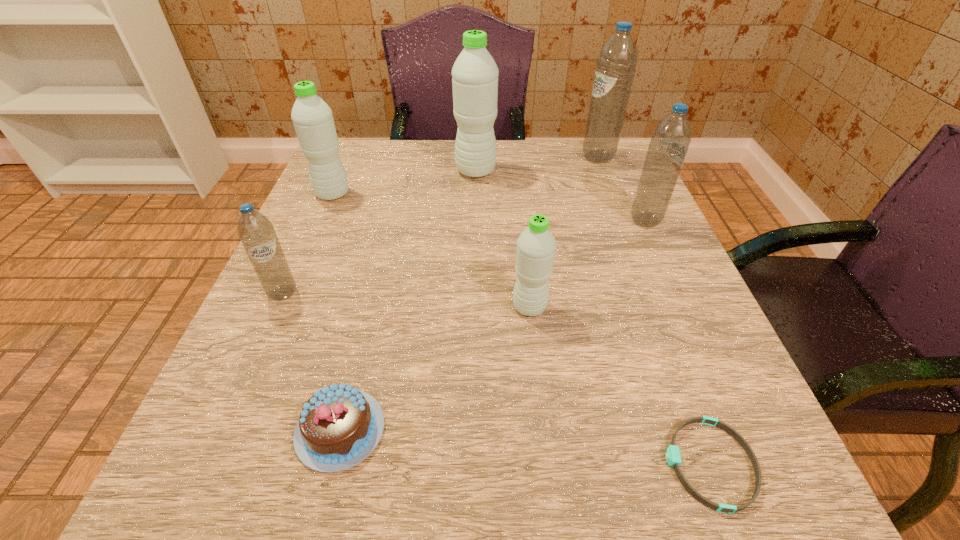
Choose which water bottle is the second nearest neighbor to the second farthest blue water bottle. Please provide its 2D coordinates. Your answer should be formatted as a tuple, i.e. [(x, y)], where the tuple contains the x and y coordinates of a point satisfying the conditions above.

[(536, 245)]

Point out which water bottle is positioned as the third nearest to the farthest green water bottle. Please provide its 2D coordinates. Your answer should be formatted as a tuple, i.e. [(x, y)], where the tuple contains the x and y coordinates of a point satisfying the conditions above.

[(669, 144)]

What are the coordinates of `green water bottle that can be found as the third closest to the shortest object` in the screenshot? It's located at (312, 118).

Identify which green water bottle is the third closest to the nearest blue water bottle. Please provide its 2D coordinates. Your answer should be formatted as a tuple, i.e. [(x, y)], where the tuple contains the x and y coordinates of a point satisfying the conditions above.

[(475, 74)]

Identify the location of blue water bottle that stands as the closest to the second smallest blue water bottle. (616, 63).

Locate which blue water bottle is the third closest to the rightmost green water bottle. Please provide its 2D coordinates. Your answer should be formatted as a tuple, i.e. [(x, y)], where the tuple contains the x and y coordinates of a point satisfying the conditions above.

[(616, 63)]

Find the location of a particular element. vacant region that satisfies the following two spatial constraints: 1. on the back side of the fourth water bottle from right to left; 2. on the right side of the sixth object from right to left is located at coordinates (403, 171).